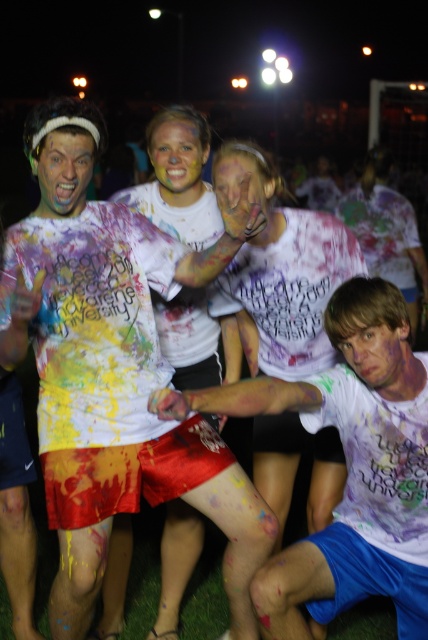
You are a photographer at the event and want to capture both the point at [372,202] and the point at [175,180] in your photo. Which point should you focus on first to ensure both are in the frame?

You should focus on point [175,180] first because it is closer to the viewer than point [372,202], which is behind it. By focusing on the closer point, both points will be in focus due to the depth of field.

In the scene shown: You are a photographer at the event and need to capture a closeup of both the smooth skin face at lower right and the yellow matte face paint at center. Which face should you zoom in more on to ensure both fit in the frame?

The smooth skin face at lower right is smaller than the yellow matte face paint at center, so you should zoom in more on the yellow matte face paint at center to accommodate its larger size while still capturing the smaller face.